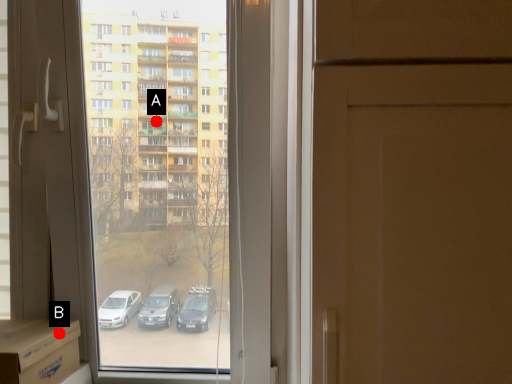
Question: Two points are circled on the image, labeled by A and B beside each circle. Which point appears farthest from the camera in this image?

Choices:
 (A) A is further
 (B) B is further

Answer: (A)